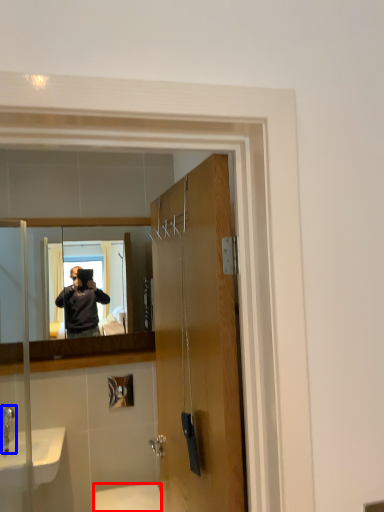
Question: Among these objects, which one is farthest to the camera, toilet (highlighted by a red box) or faucet (highlighted by a blue box)?

Choices:
 (A) toilet
 (B) faucet

Answer: (B)